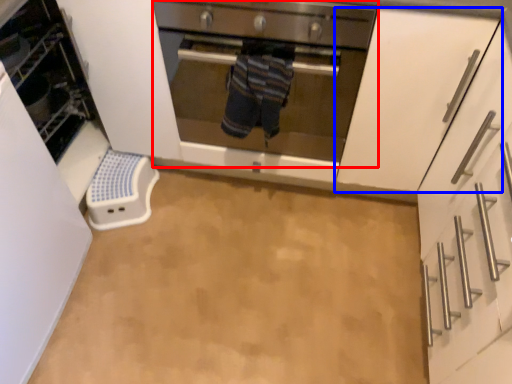
Question: Which object appears farthest to the camera in this image, oven (highlighted by a red box) or cabinetry (highlighted by a blue box)?

Choices:
 (A) oven
 (B) cabinetry

Answer: (A)